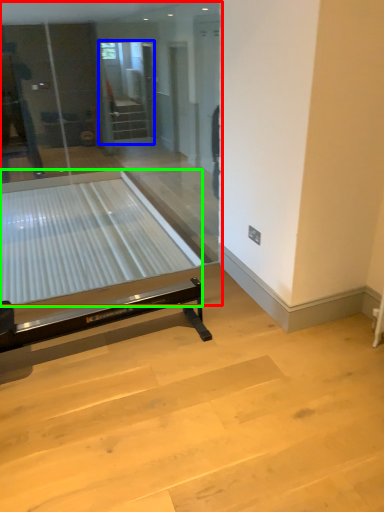
Question: Which object is the farthest from glass door (highlighted by a red box)? Choose among these: screen door (highlighted by a blue box) or glass table (highlighted by a green box).

Choices:
 (A) screen door
 (B) glass table

Answer: (A)